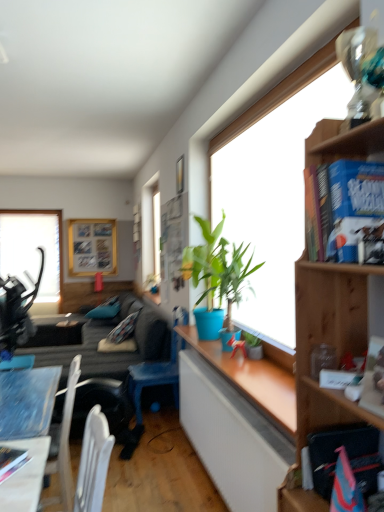
Question: Does wooden desk at lower left come in front of blue matte plant at center, arranged as the second houseplant when viewed from the back?

Choices:
 (A) no
 (B) yes

Answer: (B)

Question: Is wooden desk at lower left at the right side of blue matte plant at center, positioned as the 1th houseplant in top-to-bottom order?

Choices:
 (A) yes
 (B) no

Answer: (B)

Question: Is blue matte plant at center, placed as the first houseplant when sorted from front to back, surrounded by wooden desk at lower left?

Choices:
 (A) no
 (B) yes

Answer: (A)

Question: Considering the relative sizes of wooden desk at lower left and blue matte plant at center, marked as the second houseplant in a bottom-to-top arrangement, in the image provided, is wooden desk at lower left shorter than blue matte plant at center, marked as the second houseplant in a bottom-to-top arrangement,?

Choices:
 (A) yes
 (B) no

Answer: (B)

Question: Considering the relative sizes of wooden desk at lower left and blue matte plant at center, marked as the second houseplant in a bottom-to-top arrangement, in the image provided, is wooden desk at lower left wider than blue matte plant at center, marked as the second houseplant in a bottom-to-top arrangement,?

Choices:
 (A) no
 (B) yes

Answer: (B)

Question: From a real-world perspective, is wooden desk at lower left on blue matte plant at center, marked as the second houseplant in a bottom-to-top arrangement?

Choices:
 (A) yes
 (B) no

Answer: (B)

Question: Considering the relative sizes of hardcover book at lower left, placed as the first book when sorted from left to right, and wooden picture frame at upper left in the image provided, is hardcover book at lower left, placed as the first book when sorted from left to right, wider than wooden picture frame at upper left?

Choices:
 (A) yes
 (B) no

Answer: (A)

Question: Is hardcover book at lower left, placed as the first book when sorted from left to right, to the right of wooden picture frame at upper left from the viewer's perspective?

Choices:
 (A) yes
 (B) no

Answer: (A)

Question: Is hardcover book at lower left, marked as the 1th book in a bottom-to-top arrangement, far away from wooden picture frame at upper left?

Choices:
 (A) yes
 (B) no

Answer: (A)

Question: Considering the relative positions of hardcover book at lower left, which ranks as the third book in front-to-back order, and wooden picture frame at upper left in the image provided, is hardcover book at lower left, which ranks as the third book in front-to-back order, in front of wooden picture frame at upper left?

Choices:
 (A) no
 (B) yes

Answer: (B)

Question: Does hardcover book at lower left, which is counted as the 1th book, starting from the back, turn towards wooden picture frame at upper left?

Choices:
 (A) yes
 (B) no

Answer: (B)

Question: Does hardcover book at lower left, the 3th book viewed from the top, contain wooden picture frame at upper left?

Choices:
 (A) yes
 (B) no

Answer: (B)

Question: Is dark gray fabric couch at lower left completely or partially outside of blue hardcover book at upper right, which is the 1th book from front to back?

Choices:
 (A) yes
 (B) no

Answer: (A)